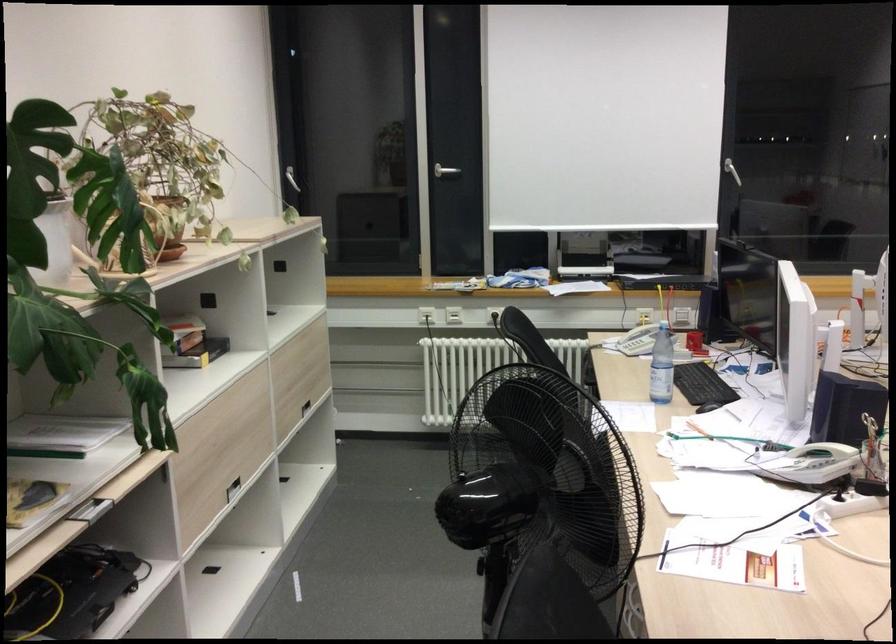
Where would you lift the white telephone handset? Please return your answer as a coordinate pair (x, y).

(814, 464)